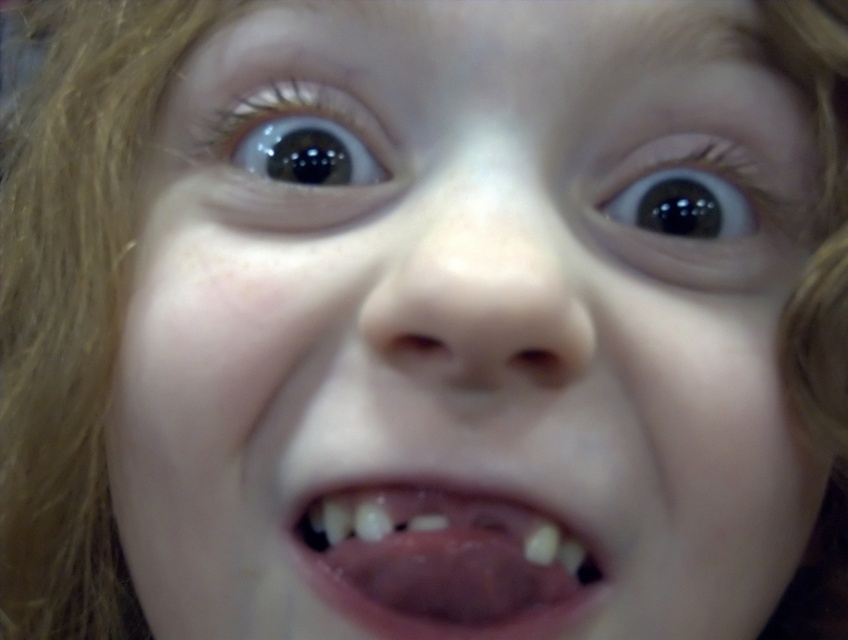
Can you confirm if yellowish toothpaste at center is thinner than brown glossy eye at upper center?

Incorrect, yellowish toothpaste at center's width is not less than brown glossy eye at upper center's.

Can you confirm if yellowish toothpaste at center is positioned above brown glossy eye at upper center?

Incorrect, yellowish toothpaste at center is not positioned above brown glossy eye at upper center.

Is point (579, 611) more distant than point (318, 173)?

No, it is in front of (318, 173).

Find the location of a particular element. The image size is (848, 640). yellowish toothpaste at center is located at coordinates (444, 561).

Can you confirm if brown glossy eye at upper right is smaller than brown glossy eye at upper center?

Actually, brown glossy eye at upper right might be larger than brown glossy eye at upper center.

Who is positioned more to the right, brown glossy eye at upper right or brown glossy eye at upper center?

brown glossy eye at upper right

The image size is (848, 640). I want to click on brown glossy eye at upper right, so click(703, 209).

Identify the location of brown glossy eye at upper right. (703, 209).

Based on the photo, does yellowish toothpaste at center have a larger size compared to brown glossy eye at upper right?

Yes, yellowish toothpaste at center is bigger than brown glossy eye at upper right.

Between yellowish toothpaste at center and brown glossy eye at upper right, which one appears on the right side from the viewer's perspective?

From the viewer's perspective, brown glossy eye at upper right appears more on the right side.

Find the location of a particular element. The image size is (848, 640). yellowish toothpaste at center is located at coordinates (444, 561).